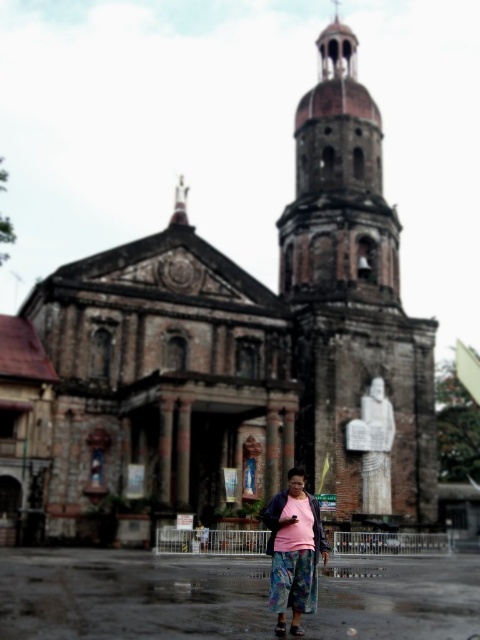
You are standing at the entrance of the historic church and want to take a photo that includes both the brown stone tower at center and the brown stone bell tower at upper right. How far apart are these two structures from your current position?

The brown stone tower at center is 9.65 feet away from the brown stone bell tower at upper right, so the distance between them from your current position is 9.65 feet.

You are standing in front of the historic church and notice the brown stone bell tower at upper right and the pink fabric at center. Which object is positioned to the right side of the other?

The brown stone bell tower at upper right is to the right of the pink fabric at center.